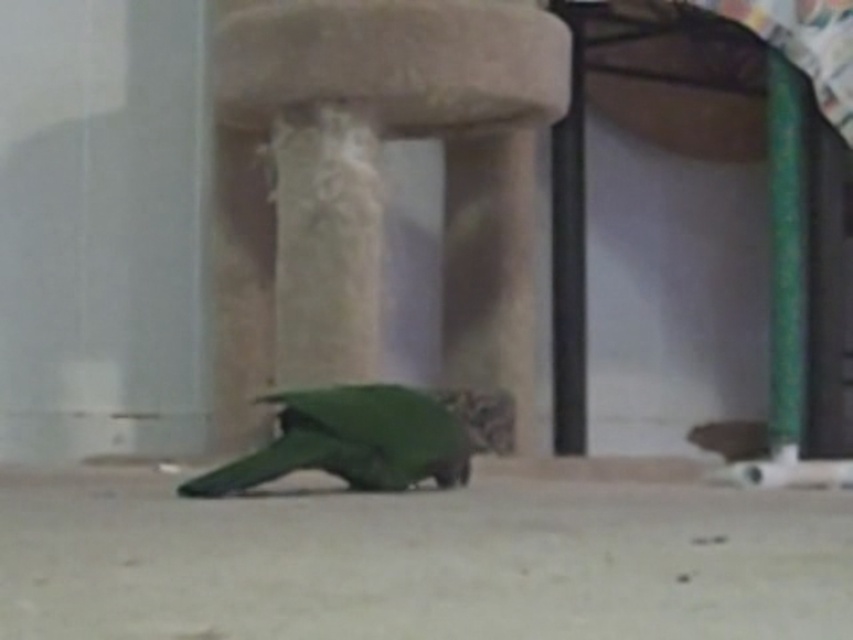
Question: Does beige textured stool at center appear under green matte parrot at center?

Choices:
 (A) no
 (B) yes

Answer: (A)

Question: Which is nearer to the green matte parrot at center?

Choices:
 (A) beige textured stool at center
 (B) green plastic pole at right

Answer: (A)

Question: Can you confirm if beige textured stool at center is thinner than green matte parrot at center?

Choices:
 (A) no
 (B) yes

Answer: (A)

Question: Which of the following is the farthest from the observer?

Choices:
 (A) (345, 396)
 (B) (270, 97)
 (C) (775, 330)

Answer: (C)

Question: Which point is closer to the camera?

Choices:
 (A) (224, 100)
 (B) (328, 467)

Answer: (B)

Question: Is beige textured stool at center behind green plastic pole at right?

Choices:
 (A) yes
 (B) no

Answer: (B)